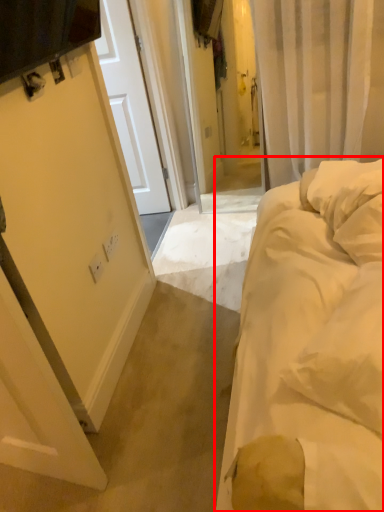
Question: Where is bed (annotated by the red box) located in relation to electric outlet in the image?

Choices:
 (A) left
 (B) right

Answer: (B)